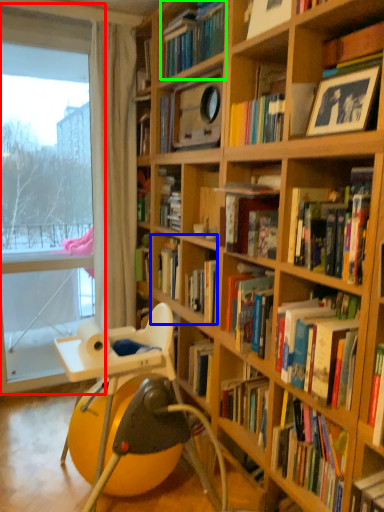
Question: Based on their relative distances, which object is nearer to window frame (highlighted by a red box)? Choose from book (highlighted by a blue box) and book (highlighted by a green box).

Choices:
 (A) book
 (B) book

Answer: (A)